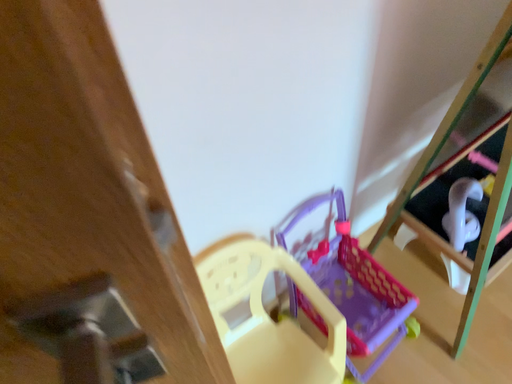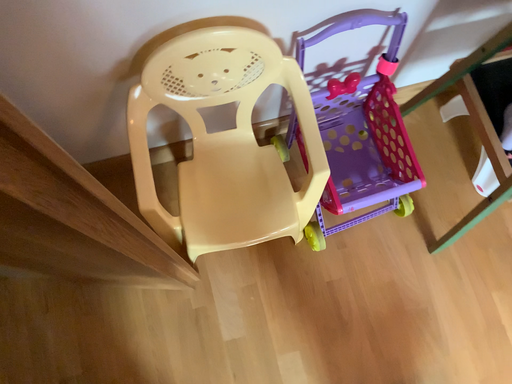
Question: How did the camera likely rotate when shooting the video?

Choices:
 (A) rotated left
 (B) rotated right

Answer: (A)